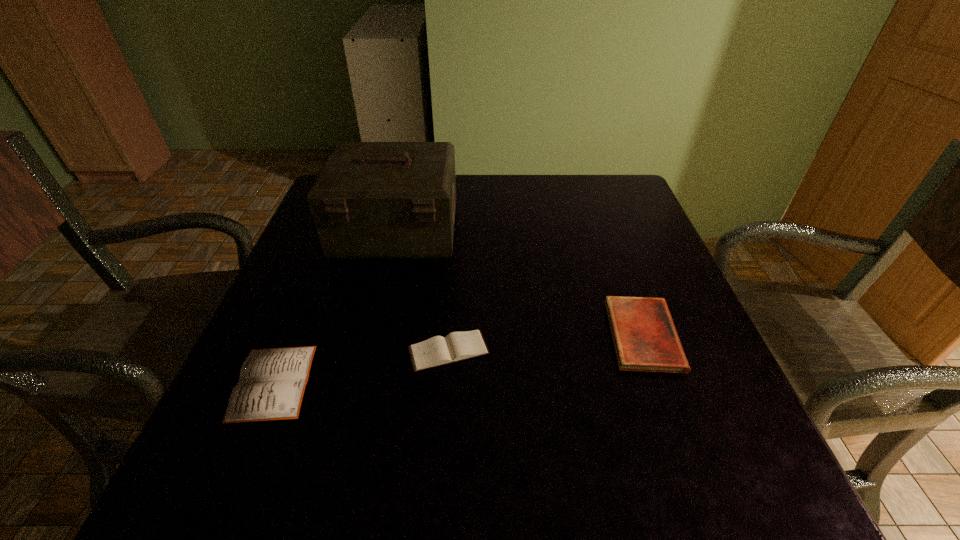
Identify the location of the first-aid kit that is at the left edge. This screenshot has width=960, height=540. (372, 200).

The image size is (960, 540). I want to click on diary that is positioned at the left edge, so click(x=272, y=382).

Locate an element on the screen. This screenshot has width=960, height=540. object that is at the right edge is located at coordinates (645, 339).

Where is `object at the far left corner`? object at the far left corner is located at coordinates (372, 200).

Image resolution: width=960 pixels, height=540 pixels. What are the coordinates of `free spot at the far edge of the desktop` in the screenshot? It's located at 515,181.

Image resolution: width=960 pixels, height=540 pixels. I want to click on vacant position at the near edge of the desktop, so click(x=430, y=449).

The height and width of the screenshot is (540, 960). Find the location of `vacant area at the left edge`. vacant area at the left edge is located at coordinates (308, 288).

Find the location of a particular element. The width and height of the screenshot is (960, 540). vacant space at the right edge of the desktop is located at coordinates (644, 236).

At what (x,y) coordinates should I click in order to perform the action: click on vacant space that is in between the first-aid kit and the second diary from left to right. Please return your answer as a coordinate pair (x, y). Looking at the image, I should click on (422, 291).

Image resolution: width=960 pixels, height=540 pixels. I want to click on vacant space that's between the tallest object and the second diary from left to right, so click(x=422, y=291).